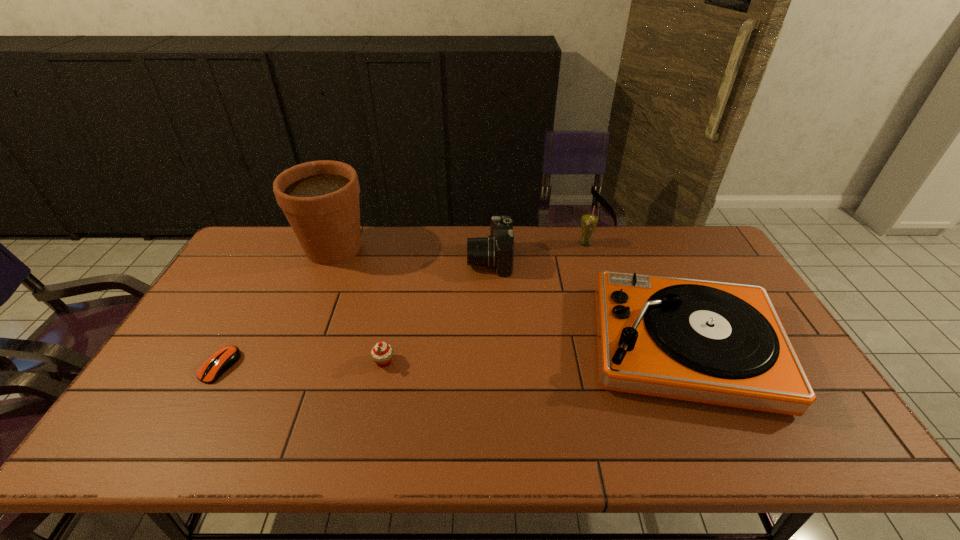
Where is `object at the near edge`? The height and width of the screenshot is (540, 960). object at the near edge is located at coordinates (719, 343).

This screenshot has width=960, height=540. Identify the location of object situated at the left edge. (219, 362).

Find the location of a particular element. object at the right edge is located at coordinates (719, 343).

At what (x,y) coordinates should I click in order to perform the action: click on object situated at the near right corner. Please return your answer as a coordinate pair (x, y). The width and height of the screenshot is (960, 540). Looking at the image, I should click on (719, 343).

Find the location of a particular element. vacant space at the far edge of the desktop is located at coordinates (453, 258).

The height and width of the screenshot is (540, 960). Identify the location of vacant position at the near edge of the desktop. (424, 424).

In the image, there is a desktop. At what (x,y) coordinates should I click in order to perform the action: click on vacant space at the left edge. Please return your answer as a coordinate pair (x, y). Looking at the image, I should click on (187, 352).

In the image, there is a desktop. At what (x,y) coordinates should I click in order to perform the action: click on vacant space at the far left corner. Please return your answer as a coordinate pair (x, y). Looking at the image, I should click on (245, 249).

The height and width of the screenshot is (540, 960). Identify the location of free space at the far right corner. (681, 228).

In the image, there is a desktop. Where is `free space at the near right corner`? The image size is (960, 540). free space at the near right corner is located at coordinates (825, 421).